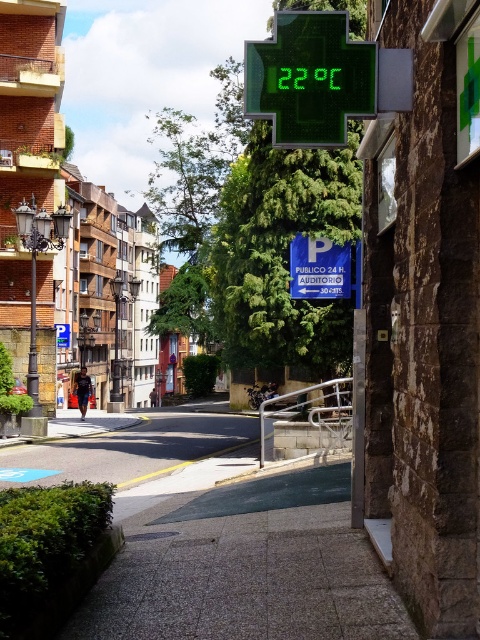
Locate an element on the screen. Image resolution: width=480 pixels, height=640 pixels. gray concrete pavement at lower center is located at coordinates (243, 564).

From the picture: Does gray concrete pavement at lower center appear under green digital display at upper center?

Correct, gray concrete pavement at lower center is located below green digital display at upper center.

Which is in front, point (313, 628) or point (250, 80)?

Point (313, 628) is more forward.

Where is `gray concrete pavement at lower center`? This screenshot has height=640, width=480. gray concrete pavement at lower center is located at coordinates (243, 564).

Can you confirm if gray concrete pavement at lower center is bigger than white plastic parking sign at center?

No, gray concrete pavement at lower center is not bigger than white plastic parking sign at center.

Which is in front, point (215, 577) or point (347, 264)?

Positioned in front is point (215, 577).

Between point (184, 627) and point (340, 264), which one is positioned in front?

Point (184, 627) is more forward.

I want to click on gray concrete pavement at lower center, so click(x=243, y=564).

Can you confirm if green digital display at upper center is positioned above white plastic parking sign at center?

Yes.

Is green digital display at upper center below white plastic parking sign at center?

Actually, green digital display at upper center is above white plastic parking sign at center.

Locate an element on the screen. Image resolution: width=480 pixels, height=640 pixels. green digital display at upper center is located at coordinates (310, 77).

This screenshot has height=640, width=480. Identify the location of green digital display at upper center. (310, 77).